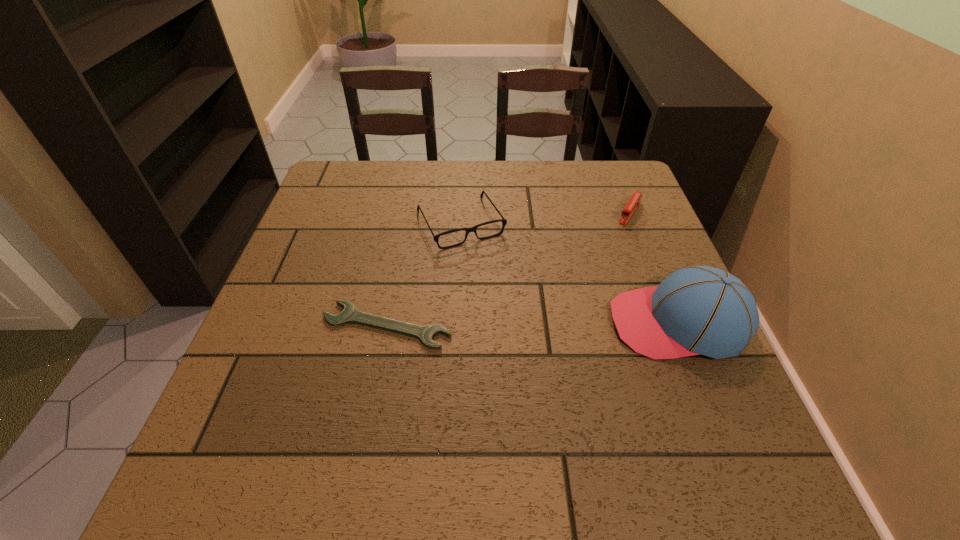
The height and width of the screenshot is (540, 960). I want to click on vacant spot on the desktop that is between the shortest object and the baseball cap and is positioned on the front-facing side of the stapler, so click(562, 324).

I want to click on free space on the desktop that is between the wrench and the tallest object and is positioned on the front-facing side of the spectacles, so click(518, 325).